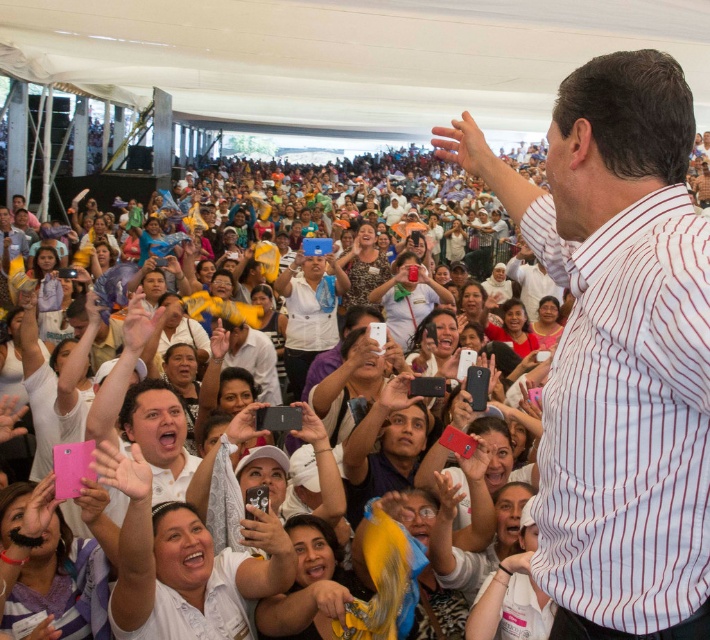
You are a photographer at the event and need to capture both the white striped shirt at center and the white matte shirt at center in a single frame. Which shirt should you focus on to ensure both are visible without zooming in or out?

The white striped shirt at center is larger than the white matte shirt at center, so focusing on the white striped shirt at center will allow both to be visible without adjusting the zoom.

You are a photographer at the event and want to capture both the white striped shirt at center and the white striped shirt at upper right in a single photo. Which one should you focus on to ensure both are in the frame?

Focus on the white striped shirt at center since it is much taller than the white striped shirt at upper right, so positioning the camera to include the taller one will likely capture the shorter one as well.

You are a photographer at the event and want to capture both the white striped shirt at center and the white striped shirt at upper right in a single photo. Which one should you focus on to ensure both are in the frame?

To capture both the white striped shirt at center and the white striped shirt at upper right in the frame, focus on the white striped shirt at center since it is in front of the other one, allowing both to be visible.